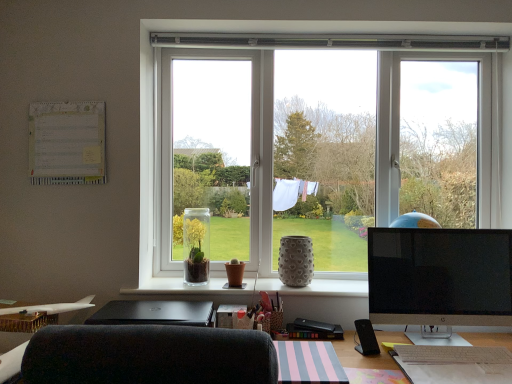
You are a GUI agent. You are given a task and a screenshot of the screen. Output one action in this format:
    pyautogui.click(x=<x>, y=<y>)
    Task: Click on the free location above pink striped notepad at lower center (from a real-world perspective)
    Image resolution: width=512 pixels, height=384 pixels.
    Given the screenshot: What is the action you would take?
    pyautogui.click(x=306, y=353)